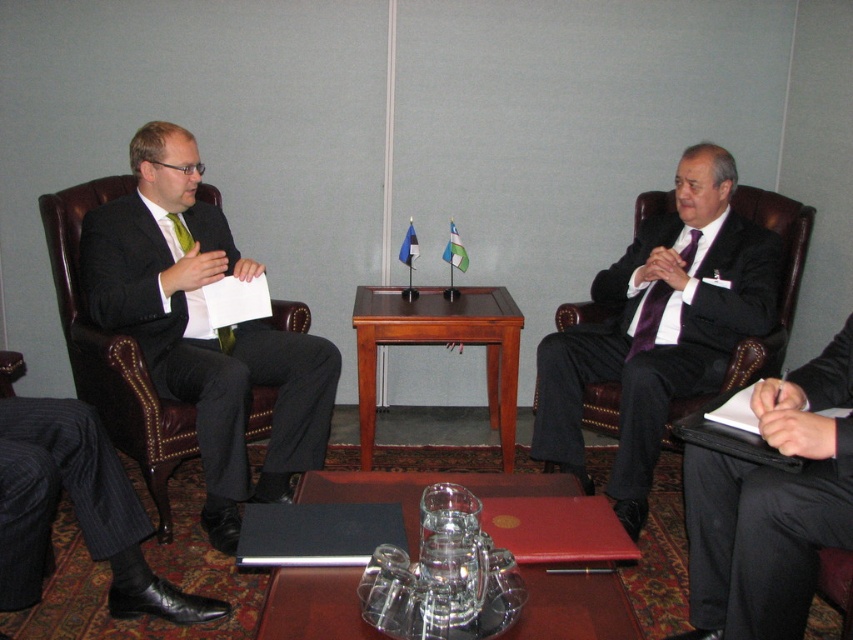
Can you confirm if purple satin suit at center is bigger than brown leather armchair at left?

Indeed, purple satin suit at center has a larger size compared to brown leather armchair at left.

Is purple satin suit at center to the right of brown leather armchair at left from the viewer's perspective?

Correct, you'll find purple satin suit at center to the right of brown leather armchair at left.

This screenshot has height=640, width=853. What are the coordinates of `purple satin suit at center` in the screenshot? It's located at (659, 328).

Identify the location of brown wooden table at center. (440, 344).

Does brown wooden table at center appear on the right side of purple satin tie at center?

Incorrect, brown wooden table at center is not on the right side of purple satin tie at center.

Which is in front, point (358, 339) or point (663, 280)?

Point (663, 280) is in front.

Locate an element on the screen. The width and height of the screenshot is (853, 640). brown wooden table at center is located at coordinates (440, 344).

Can you confirm if transparent glass table at center is bigger than brown wooden table at center?

No, transparent glass table at center is not bigger than brown wooden table at center.

Who is more forward, (303, 586) or (364, 298)?

Positioned in front is point (303, 586).

This screenshot has height=640, width=853. What do you see at coordinates (520, 541) in the screenshot? I see `transparent glass table at center` at bounding box center [520, 541].

At what (x,y) coordinates should I click in order to perform the action: click on transparent glass table at center. Please return your answer as a coordinate pair (x, y). The height and width of the screenshot is (640, 853). Looking at the image, I should click on (520, 541).